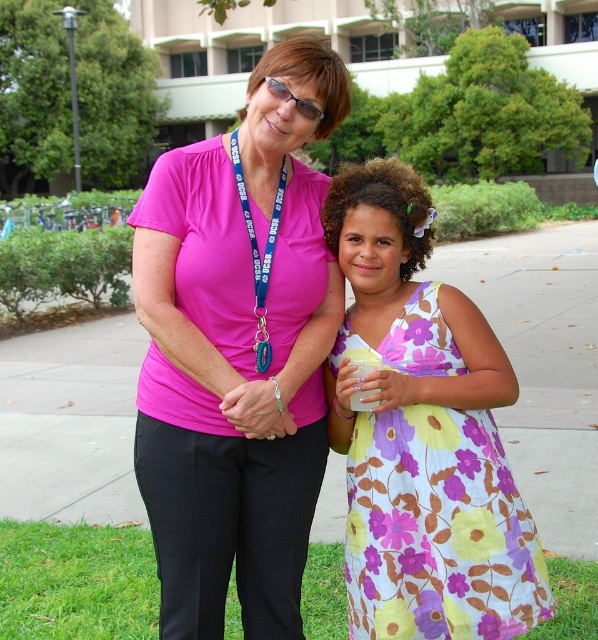
Question: Is pink fabric shirt at center closer to the viewer compared to floral cotton dress at center?

Choices:
 (A) no
 (B) yes

Answer: (A)

Question: Is paved concrete sidewalk at center smaller than floral cotton dress at center?

Choices:
 (A) yes
 (B) no

Answer: (B)

Question: Can you confirm if paved concrete sidewalk at center is thinner than floral cotton dress at center?

Choices:
 (A) no
 (B) yes

Answer: (A)

Question: Which object is the farthest from the paved concrete sidewalk at center?

Choices:
 (A) pink fabric shirt at center
 (B) floral cotton dress at center

Answer: (A)

Question: Which point is closer to the camera?

Choices:
 (A) (331, 534)
 (B) (401, 624)
 (C) (181, 458)

Answer: (C)

Question: Which point is closer to the camera taking this photo?

Choices:
 (A) (379, 529)
 (B) (221, 616)
 (C) (496, 320)

Answer: (A)